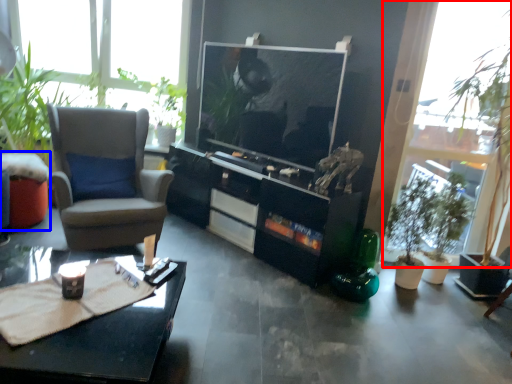
Question: Which object appears closest to the camera in this image, window (highlighted by a red box) or table (highlighted by a blue box)?

Choices:
 (A) window
 (B) table

Answer: (A)